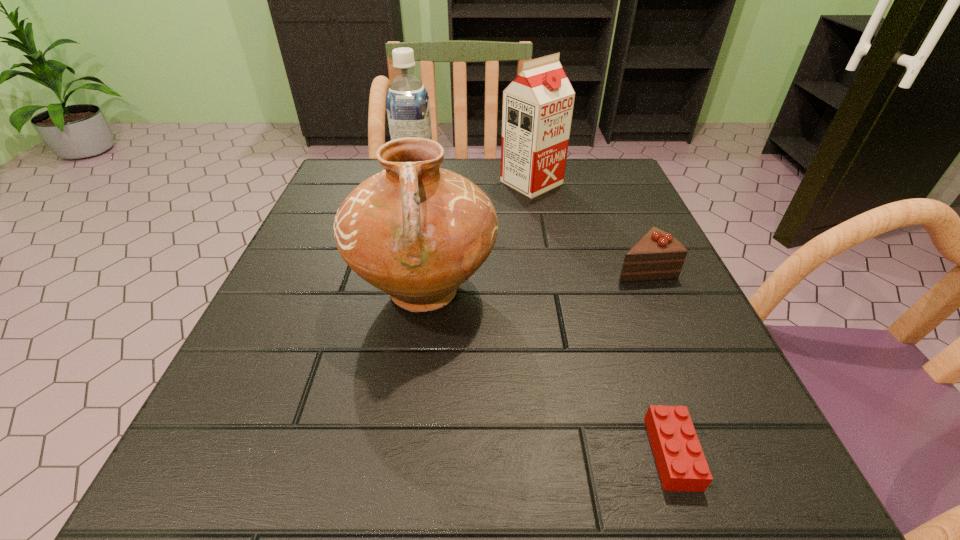
Find the location of a particular element. The height and width of the screenshot is (540, 960). vacant space at the far edge of the desktop is located at coordinates (451, 163).

In order to click on free space at the near edge in this screenshot , I will do `click(613, 457)`.

Locate an element on the screen. free region at the left edge of the desktop is located at coordinates (238, 368).

Identify the location of vacant space at the right edge of the desktop. This screenshot has width=960, height=540. (601, 305).

I want to click on vacant space at the far left corner of the desktop, so click(x=332, y=174).

Where is `vacant space at the far right corner of the desktop`? vacant space at the far right corner of the desktop is located at coordinates (578, 180).

Find the location of a particular element. The height and width of the screenshot is (540, 960). free spot between the pottery and the Lego is located at coordinates (548, 372).

Image resolution: width=960 pixels, height=540 pixels. I want to click on free space that is in between the left soya milk and the nearest object, so click(544, 318).

Locate an element on the screen. This screenshot has height=540, width=960. vacant area between the right soya milk and the chocolate cake is located at coordinates (588, 225).

Image resolution: width=960 pixels, height=540 pixels. I want to click on empty space that is in between the pottery and the shortest object, so click(x=548, y=372).